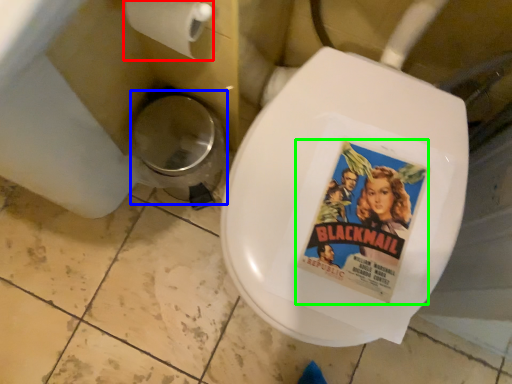
Question: Considering the real-world distances, which object is farthest from toilet paper (highlighted by a red box)? potty (highlighted by a blue box) or movie poster (highlighted by a green box)?

Choices:
 (A) potty
 (B) movie poster

Answer: (B)